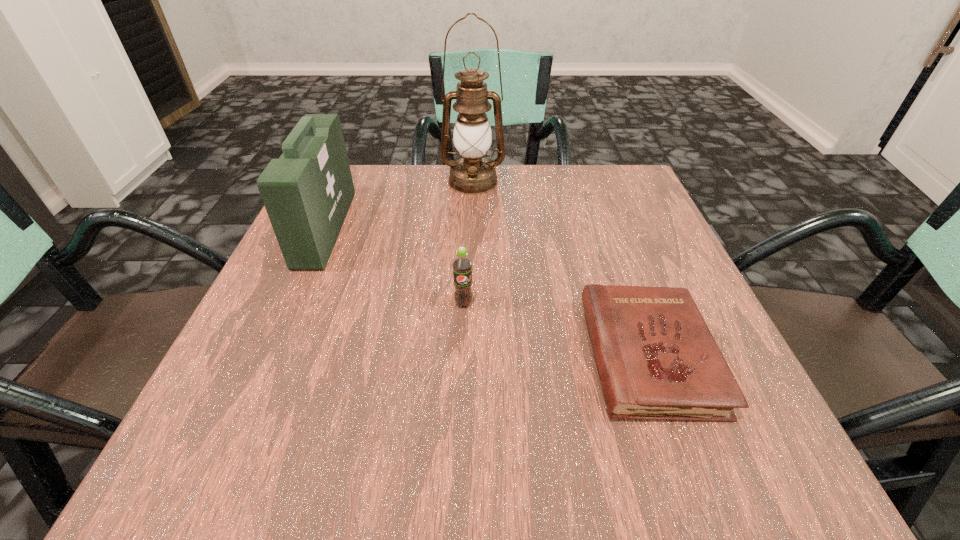
The image size is (960, 540). What are the coordinates of `oil lamp at the far edge` in the screenshot? It's located at (472, 174).

This screenshot has width=960, height=540. I want to click on the first-aid kit that is at the far edge, so click(x=307, y=192).

At what (x,y) coordinates should I click in order to perform the action: click on object at the near edge. Please return your answer as a coordinate pair (x, y). This screenshot has height=540, width=960. Looking at the image, I should click on (657, 359).

Locate an element on the screen. The width and height of the screenshot is (960, 540). object that is at the left edge is located at coordinates (307, 192).

Find the location of `object situated at the right edge`. object situated at the right edge is located at coordinates (657, 359).

This screenshot has width=960, height=540. I want to click on object present at the far left corner, so click(x=307, y=192).

I want to click on object at the near right corner, so click(657, 359).

This screenshot has height=540, width=960. Identify the location of free space at the far edge of the desktop. (391, 184).

Identify the location of free location at the near edge. The width and height of the screenshot is (960, 540). (x=622, y=424).

In the image, there is a desktop. Where is `vacant space at the left edge`? This screenshot has width=960, height=540. vacant space at the left edge is located at coordinates [x=337, y=304].